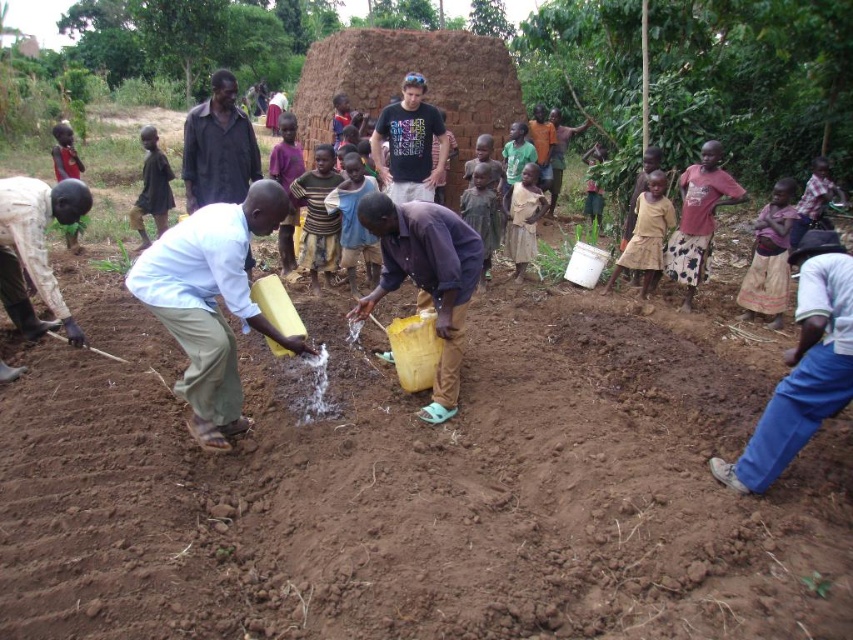
Question: Does light brown wooden stick at center have a larger size compared to brown striped shirt at center?

Choices:
 (A) no
 (B) yes

Answer: (A)

Question: Can you confirm if light brown wooden stick at center is positioned above light brown fabric dress at center?

Choices:
 (A) no
 (B) yes

Answer: (A)

Question: Which object is positioned farthest from the brown textured dress at right?

Choices:
 (A) light yellow plastic jug at center
 (B) dark brown skin at lower left
 (C) black t-shirt at center

Answer: (B)

Question: Which of the following is the closest to the observer?

Choices:
 (A) (488, 205)
 (B) (404, 260)
 (C) (637, 234)

Answer: (B)

Question: Estimate the real-world distances between objects in this image. Which object is closer to the dark brown shirt at center?

Choices:
 (A) dark brown skin at lower left
 (B) light yellow plastic jug at center
 (C) dark brown fabric shirt at left

Answer: (C)

Question: Is light yellow plastic jug at center thinner than brown printed skirt at right?

Choices:
 (A) no
 (B) yes

Answer: (A)